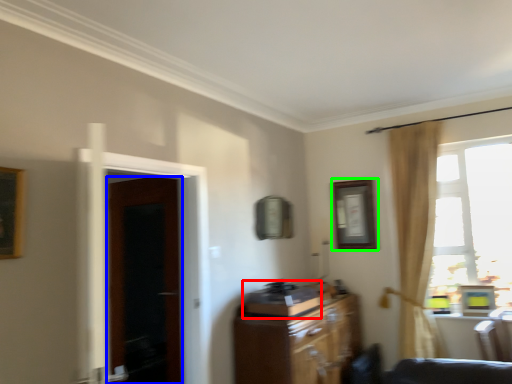
Question: Which object is the farthest from appliance (highlighted by a red box)? Choose among these: door (highlighted by a blue box) or picture frame (highlighted by a green box).

Choices:
 (A) door
 (B) picture frame

Answer: (A)